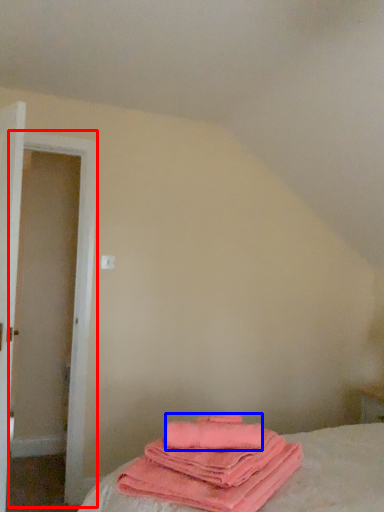
Question: Which point is closer to the camera, door (highlighted by a red box) or beach towel (highlighted by a blue box)?

Choices:
 (A) door
 (B) beach towel

Answer: (B)